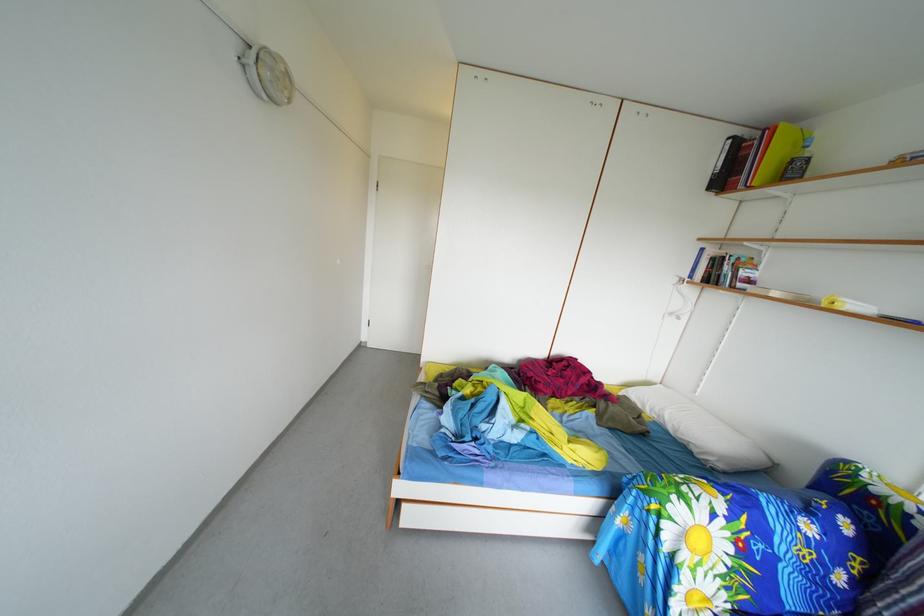
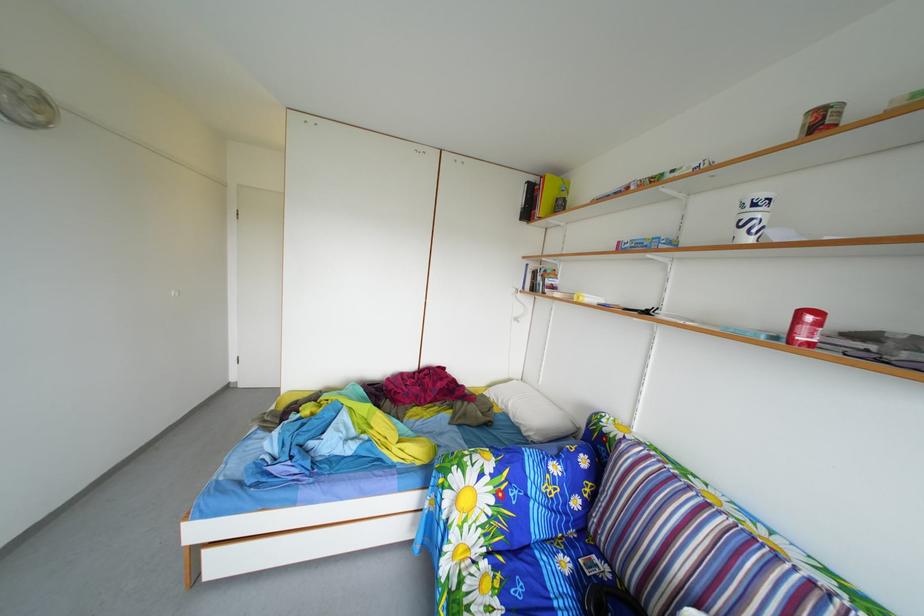
Find the pixel in the second image that matches point 669,536 in the first image.

(453, 507)